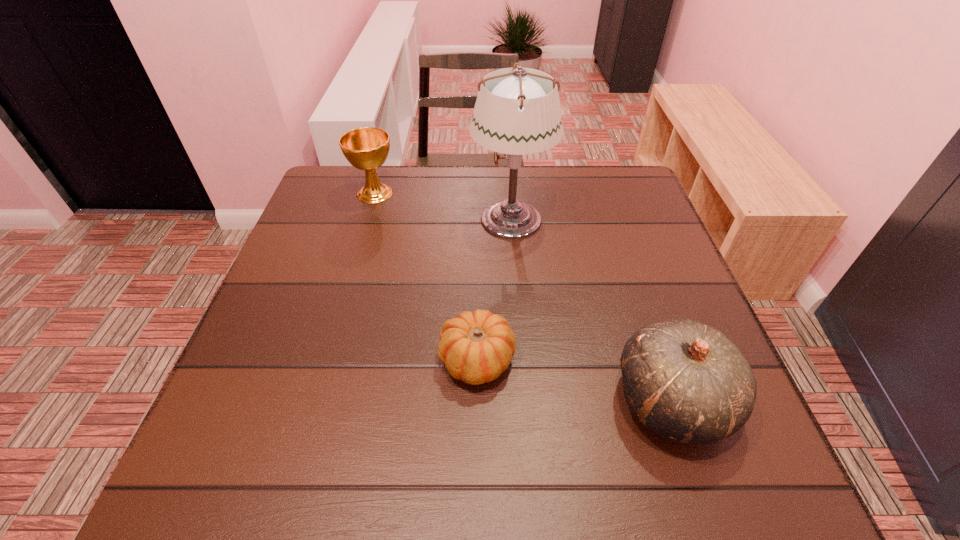
Where is `vacant area situated on the back of the rightmost object`? The width and height of the screenshot is (960, 540). vacant area situated on the back of the rightmost object is located at coordinates (622, 253).

Locate an element on the screen. The image size is (960, 540). vacant space located on the right of the shorter gourd is located at coordinates point(684,360).

Locate an element on the screen. lampshade that is at the far edge is located at coordinates (517, 112).

Locate an element on the screen. This screenshot has width=960, height=540. chalice present at the far edge is located at coordinates (366, 148).

Identify the location of object positioned at the near edge. (686, 381).

The width and height of the screenshot is (960, 540). What are the coordinates of `object positioned at the left edge` in the screenshot? It's located at (366, 148).

Identify the location of object situated at the right edge. This screenshot has width=960, height=540. (686, 381).

Identify the location of object that is at the far left corner. This screenshot has width=960, height=540. [x=366, y=148].

Image resolution: width=960 pixels, height=540 pixels. I want to click on object at the near right corner, so (686, 381).

This screenshot has height=540, width=960. In the image, there is a desktop. What are the coordinates of `vacant space at the far edge` in the screenshot? It's located at (399, 191).